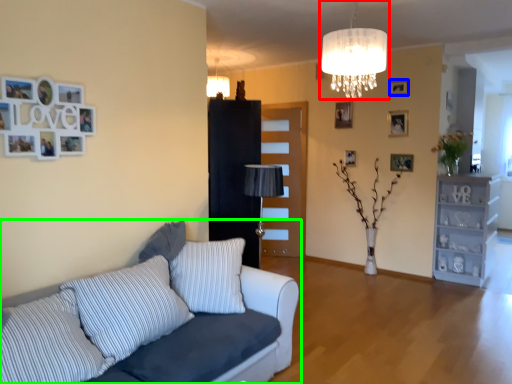
Question: Considering the real-world distances, which object is closest to lamp (highlighted by a red box)? picture frame (highlighted by a blue box) or studio couch (highlighted by a green box).

Choices:
 (A) picture frame
 (B) studio couch

Answer: (B)